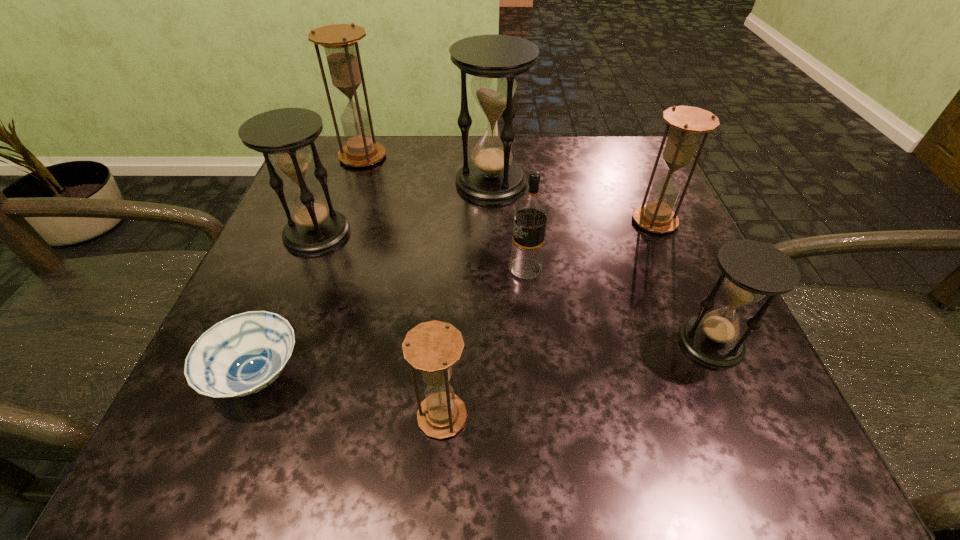
The width and height of the screenshot is (960, 540). In order to click on the nearest hourglass in this screenshot , I will do `click(432, 347)`.

Where is `the smallest black hourglass`? the smallest black hourglass is located at coordinates (752, 269).

Find the location of a particular element. the nearest black hourglass is located at coordinates (752, 269).

This screenshot has width=960, height=540. Find the location of `the shortest object`. the shortest object is located at coordinates [243, 354].

Find the location of a particular element. The image size is (960, 540). soup bowl is located at coordinates (243, 354).

The width and height of the screenshot is (960, 540). I want to click on vacant point located 0.150m on the front of the leftmost brown hourglass, so click(344, 211).

This screenshot has height=540, width=960. Find the location of `blank space located on the right of the farthest black hourglass`. blank space located on the right of the farthest black hourglass is located at coordinates (626, 183).

What are the coordinates of `free spot located 0.120m on the left of the second smallest brown hourglass` in the screenshot? It's located at (570, 221).

This screenshot has height=540, width=960. In order to click on vacant area situated on the front of the second biggest black hourglass in this screenshot , I will do `click(290, 303)`.

Identify the location of free space located on the label of the vodka. (375, 268).